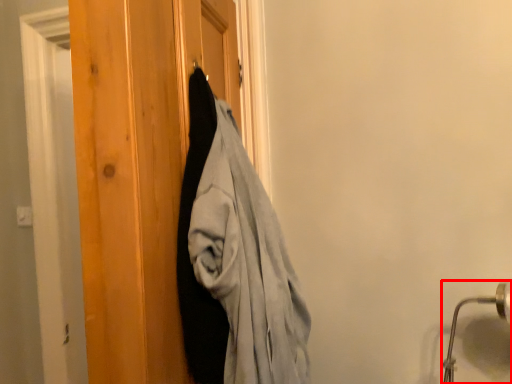
Question: From the image's perspective, what is the correct spatial positioning of door handle (annotated by the red box) in reference to barn door?

Choices:
 (A) below
 (B) above

Answer: (A)